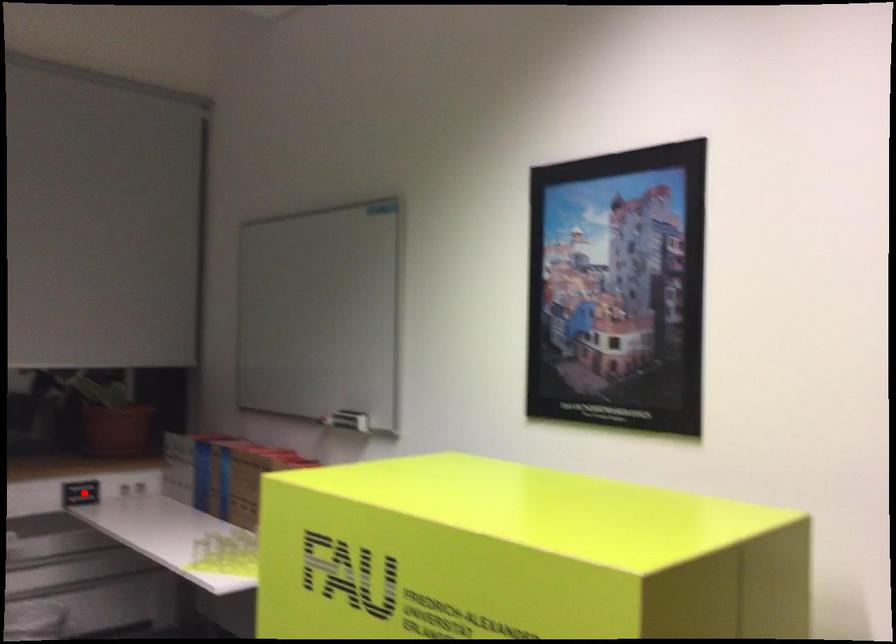
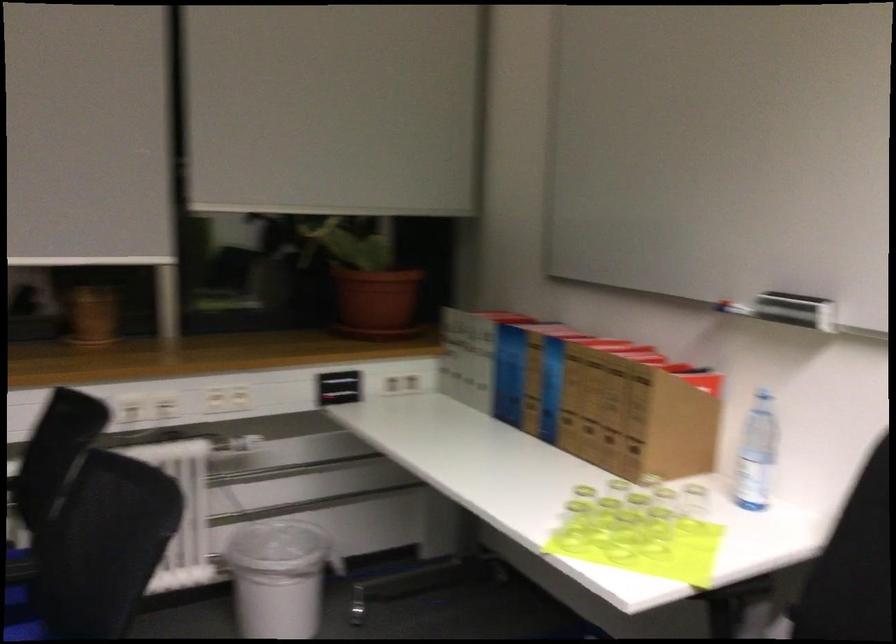
The point at the highlighted location is marked in the first image. Where is the corresponding point in the second image?

(339, 386)